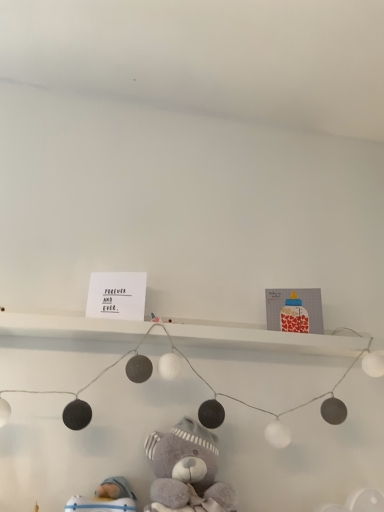
Find the location of a particular element. fluffy gray teddy bear at lower center is located at coordinates (187, 468).

Describe the element at coordinates (187, 468) in the screenshot. I see `fluffy gray teddy bear at lower center` at that location.

Measure the distance between blue fabric toy at lower left and camera.

blue fabric toy at lower left is 32.80 inches away from camera.

Locate an element on the screen. The width and height of the screenshot is (384, 512). blue fabric toy at lower left is located at coordinates (106, 498).

What do you see at coordinates (106, 498) in the screenshot? I see `blue fabric toy at lower left` at bounding box center [106, 498].

Locate an element on the screen. fluffy gray teddy bear at lower center is located at coordinates (187, 468).

Does blue fabric toy at lower left appear on the left side of fluffy gray teddy bear at lower center?

Yes, blue fabric toy at lower left is to the left of fluffy gray teddy bear at lower center.

From the picture: Which object is closer to the camera, blue fabric toy at lower left or fluffy gray teddy bear at lower center?

fluffy gray teddy bear at lower center is closer to the camera.

Does point (94, 508) lie behind point (169, 488)?

Yes, point (94, 508) is behind point (169, 488).

From the image's perspective, is blue fabric toy at lower left located above or below fluffy gray teddy bear at lower center?

From the image's perspective, blue fabric toy at lower left appears below fluffy gray teddy bear at lower center.

From a real-world perspective, is blue fabric toy at lower left positioned over fluffy gray teddy bear at lower center based on gravity?

No.

Which of these two, blue fabric toy at lower left or fluffy gray teddy bear at lower center, is wider?

fluffy gray teddy bear at lower center is wider.

Which of these two, blue fabric toy at lower left or fluffy gray teddy bear at lower center, stands shorter?

blue fabric toy at lower left.

Considering the sizes of blue fabric toy at lower left and fluffy gray teddy bear at lower center in the image, is blue fabric toy at lower left bigger or smaller than fluffy gray teddy bear at lower center?

Clearly, blue fabric toy at lower left is smaller in size than fluffy gray teddy bear at lower center.

Is blue fabric toy at lower left situated inside fluffy gray teddy bear at lower center or outside?

blue fabric toy at lower left lies outside fluffy gray teddy bear at lower center.

From the picture: Does blue fabric toy at lower left touch fluffy gray teddy bear at lower center?

There is a gap between blue fabric toy at lower left and fluffy gray teddy bear at lower center.

Is blue fabric toy at lower left oriented away from fluffy gray teddy bear at lower center?

blue fabric toy at lower left does not have its back to fluffy gray teddy bear at lower center.

How many degrees apart are the facing directions of blue fabric toy at lower left and fluffy gray teddy bear at lower center?

The angle between the facing direction of blue fabric toy at lower left and the facing direction of fluffy gray teddy bear at lower center is 0.000482 degrees.

How distant is blue fabric toy at lower left from fluffy gray teddy bear at lower center?

blue fabric toy at lower left and fluffy gray teddy bear at lower center are 5.45 inches apart from each other.

Where is `toy behind the fluffy gray teddy bear at lower center`? This screenshot has height=512, width=384. toy behind the fluffy gray teddy bear at lower center is located at coordinates (106, 498).

Can you confirm if fluffy gray teddy bear at lower center is positioned to the left of blue fabric toy at lower left?

In fact, fluffy gray teddy bear at lower center is to the right of blue fabric toy at lower left.

Is the position of fluffy gray teddy bear at lower center less distant than that of blue fabric toy at lower left?

Yes, fluffy gray teddy bear at lower center is in front of blue fabric toy at lower left.

Does point (204, 494) appear closer or farther from the camera than point (85, 504)?

Point (204, 494) appears to be closer to the viewer than point (85, 504).

From the image's perspective, which is below, fluffy gray teddy bear at lower center or blue fabric toy at lower left?

blue fabric toy at lower left, from the image's perspective.

From a real-world perspective, which is physically below, fluffy gray teddy bear at lower center or blue fabric toy at lower left?

From a 3D spatial view, blue fabric toy at lower left is below.

Does fluffy gray teddy bear at lower center have a lesser width compared to blue fabric toy at lower left?

Incorrect, the width of fluffy gray teddy bear at lower center is not less than that of blue fabric toy at lower left.

In the scene shown: Is fluffy gray teddy bear at lower center shorter than blue fabric toy at lower left?

No.

Can you confirm if fluffy gray teddy bear at lower center is smaller than blue fabric toy at lower left?

Actually, fluffy gray teddy bear at lower center might be larger than blue fabric toy at lower left.

Looking at this image, is blue fabric toy at lower left located within fluffy gray teddy bear at lower center?

No, blue fabric toy at lower left is not a part of fluffy gray teddy bear at lower center.

Is there a large distance between fluffy gray teddy bear at lower center and blue fabric toy at lower left?

fluffy gray teddy bear at lower center is near blue fabric toy at lower left, not far away.

Is fluffy gray teddy bear at lower center aimed at blue fabric toy at lower left?

No, fluffy gray teddy bear at lower center is not aimed at blue fabric toy at lower left.

Measure the distance from fluffy gray teddy bear at lower center to blue fabric toy at lower left.

The distance of fluffy gray teddy bear at lower center from blue fabric toy at lower left is 5.45 inches.

Identify the location of teddy bear above the blue fabric toy at lower left (from a real-world perspective). (187, 468).

The image size is (384, 512). In order to click on toy located on the left of fluffy gray teddy bear at lower center in this screenshot , I will do `click(106, 498)`.

What are the coordinates of `toy behind the fluffy gray teddy bear at lower center` in the screenshot? It's located at (106, 498).